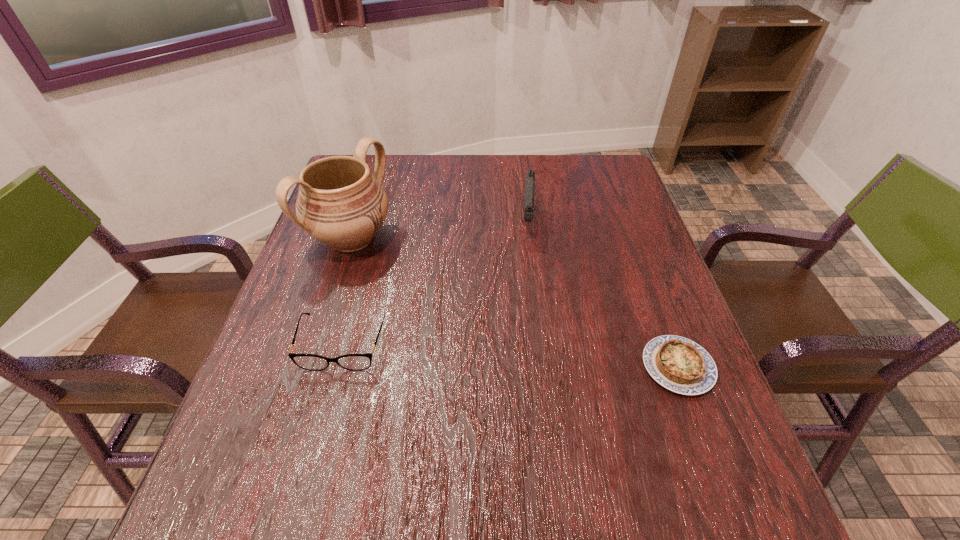
Find the location of a particular element. empty space that is in between the urn and the rightmost object is located at coordinates (515, 303).

The image size is (960, 540). Identify the location of empty location between the spectacles and the shortest object. (x=511, y=355).

At what (x,y) coordinates should I click in order to perform the action: click on unoccupied area between the third shortest object and the urn. Please return your answer as a coordinate pair (x, y). The height and width of the screenshot is (540, 960). Looking at the image, I should click on (440, 231).

The height and width of the screenshot is (540, 960). In order to click on free point between the second object from right to left and the tallest object in this screenshot , I will do [x=440, y=231].

Locate which object is the closest to the second object from right to left. Please provide its 2D coordinates. Your answer should be formatted as a tuple, i.e. [(x, y)], where the tuple contains the x and y coordinates of a point satisfying the conditions above.

[(340, 203)]

This screenshot has height=540, width=960. Find the location of `object that is the third closest to the second tallest object`. object that is the third closest to the second tallest object is located at coordinates (355, 362).

At what (x,y) coordinates should I click in order to perform the action: click on vacant region that satisfies the following two spatial constraints: 1. on the front-facing side of the shortest object; 2. on the left side of the spectacles. Please return your answer as a coordinate pair (x, y). Looking at the image, I should click on (337, 367).

Locate an element on the screen. vacant point that satisfies the following two spatial constraints: 1. on the front-facing side of the third tallest object; 2. on the right side of the quiche is located at coordinates (337, 367).

I want to click on vacant space that satisfies the following two spatial constraints: 1. on the front side of the urn; 2. on the left side of the shortest object, so click(311, 367).

Find the location of `vacant area in the image that satisfies the following two spatial constraints: 1. on the front-facing side of the third tallest object; 2. on the right side of the quiche`. vacant area in the image that satisfies the following two spatial constraints: 1. on the front-facing side of the third tallest object; 2. on the right side of the quiche is located at coordinates (337, 367).